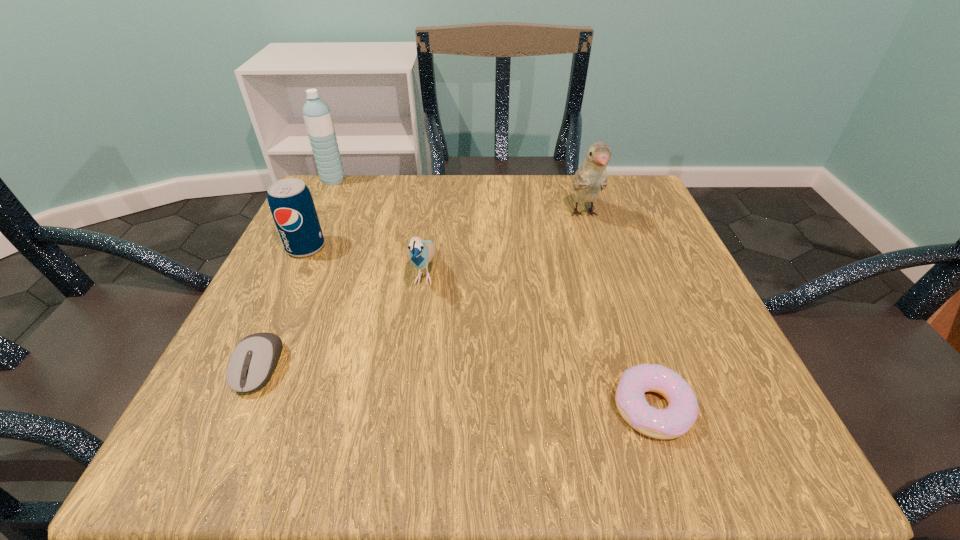
Locate an element on the screen. Image resolution: width=960 pixels, height=540 pixels. empty space that is in between the water bottle and the computer equipment is located at coordinates (297, 274).

Where is `free space between the shorter bird and the tallest object`? This screenshot has width=960, height=540. free space between the shorter bird and the tallest object is located at coordinates (379, 226).

Identify the location of vacant space that's between the nearer bird and the computer equipment. (342, 320).

Where is `unoccupied position between the doughnut and the farthest object`? The image size is (960, 540). unoccupied position between the doughnut and the farthest object is located at coordinates (492, 294).

Identify which object is the fifth closest to the pop. Please provide its 2D coordinates. Your answer should be formatted as a tuple, i.e. [(x, y)], where the tuple contains the x and y coordinates of a point satisfying the conditions above.

[(675, 420)]

In order to click on object that is the second nearest to the doughnut in this screenshot , I will do `click(591, 177)`.

The width and height of the screenshot is (960, 540). Identify the location of free location that satisfies the following two spatial constraints: 1. on the wheel side of the doughnut; 2. on the right side of the computer equipment. (241, 408).

I want to click on vacant space that satisfies the following two spatial constraints: 1. at the face of the doughnut; 2. on the right side of the shorter bird, so click(x=405, y=408).

Where is `free location that satisfies the following two spatial constraints: 1. on the wheel side of the computer equipment; 2. on the left side of the doughnut`? Image resolution: width=960 pixels, height=540 pixels. free location that satisfies the following two spatial constraints: 1. on the wheel side of the computer equipment; 2. on the left side of the doughnut is located at coordinates (241, 408).

Locate an element on the screen. The width and height of the screenshot is (960, 540). free space that satisfies the following two spatial constraints: 1. at the face of the doughnut; 2. on the left side of the fifth shortest object is located at coordinates (643, 408).